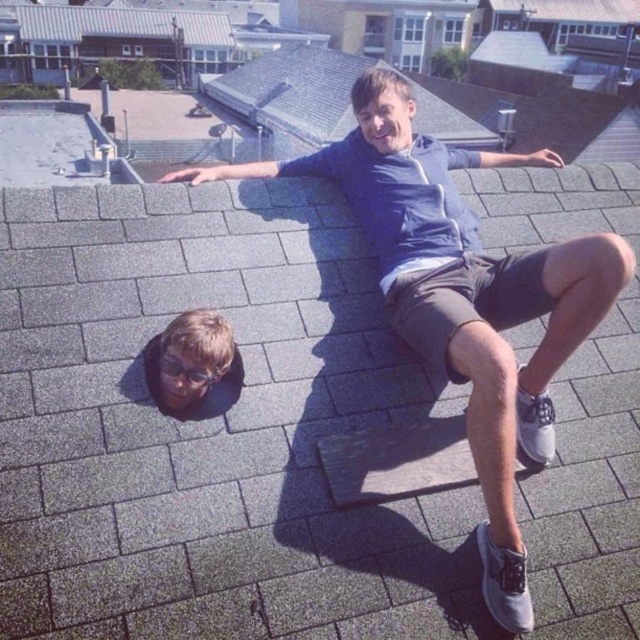
You are a photographer trying to capture a photo of the matte blue hoodie at upper center and the blonde hair at lower left. Which object is wider in the image?

The matte blue hoodie at upper center might be wider than blonde hair at lower left according to the description.

You are standing on the rooftop and want to place a small potted plant exactly where the matte blue hoodie at upper center is currently located. Based on the coordinates provided, is this location safe to place the plant without it being in direct sunlight? Please explain your reasoning using the scene description.

The matte blue hoodie at upper center is located at point [461,296]. Since the scene mentions the shadow of the foreground person is cast prominently across the roof tiles, the area where the hoodie is placed might be in shadow. However, without specific information about the sun angle or roof orientation, we cannot confirm if this spot is in direct sunlight. The safest assumption is to avoid placing the plant there unless confirmed.